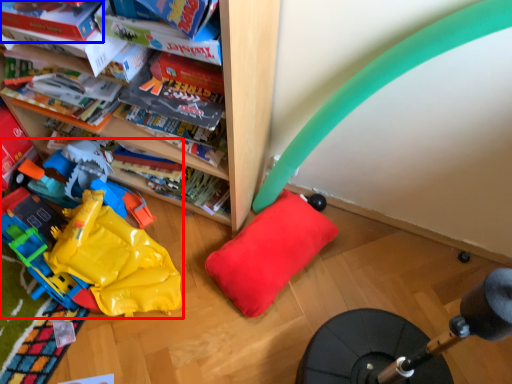
Question: Which point is further to the camera, toy (highlighted by a red box) or book (highlighted by a blue box)?

Choices:
 (A) toy
 (B) book

Answer: (A)